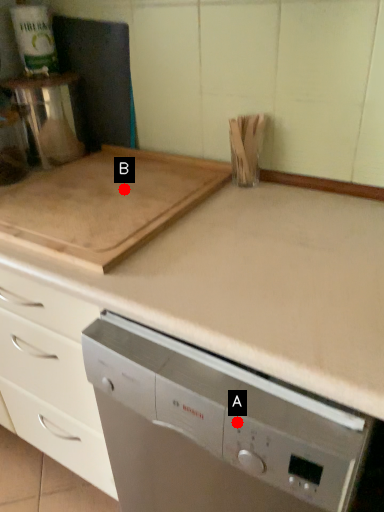
Question: Two points are circled on the image, labeled by A and B beside each circle. Which of the following is the farthest from the observer?

Choices:
 (A) A is further
 (B) B is further

Answer: (B)